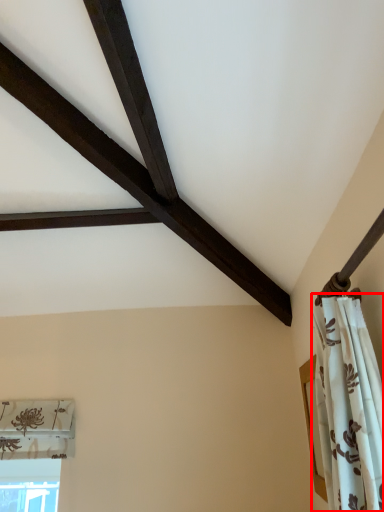
Question: From the image's perspective, where is curtain (annotated by the red box) located in relation to window in the image?

Choices:
 (A) above
 (B) below

Answer: (A)